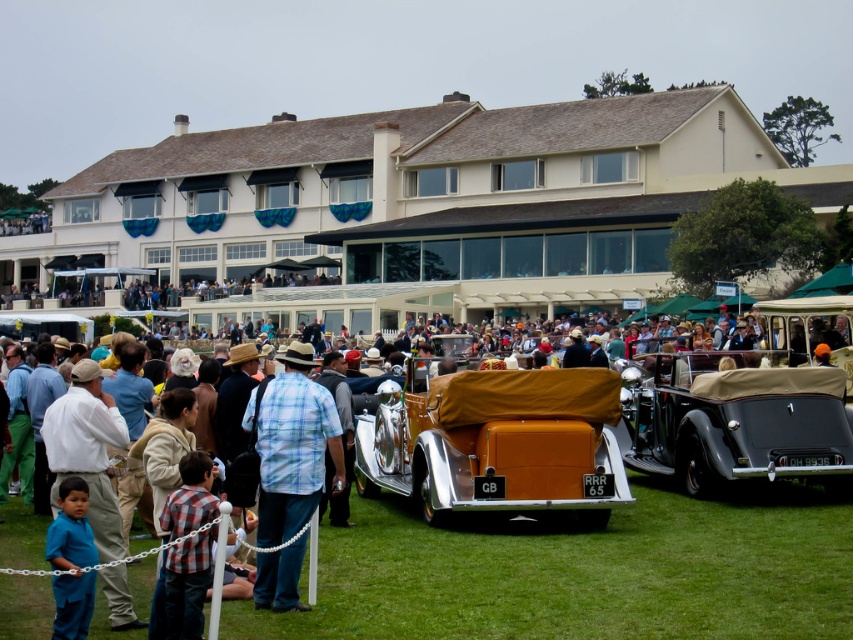
Who is taller, plaid shirt at center or blue cotton shirt at lower left?

With more height is plaid shirt at center.

Between plaid shirt at center and blue cotton shirt at lower left, which one appears on the right side from the viewer's perspective?

Positioned to the right is plaid shirt at center.

Is point (202, 496) positioned in front of point (85, 556)?

That is False.

What are the coordinates of `plaid shirt at center` in the screenshot? It's located at (183, 588).

Does green grass at lower center come behind blue plaid shirt at center?

No, green grass at lower center is in front of blue plaid shirt at center.

Can you confirm if green grass at lower center is taller than blue plaid shirt at center?

In fact, green grass at lower center may be shorter than blue plaid shirt at center.

Which is in front, point (444, 566) or point (277, 433)?

Positioned in front is point (277, 433).

Where is `green grass at lower center`? The height and width of the screenshot is (640, 853). green grass at lower center is located at coordinates (584, 572).

Can you confirm if green grass at lower center is bigger than blue cotton shirt at lower left?

Yes.

Based on the photo, can you confirm if green grass at lower center is thinner than blue cotton shirt at lower left?

In fact, green grass at lower center might be wider than blue cotton shirt at lower left.

Describe the element at coordinates (584, 572) in the screenshot. I see `green grass at lower center` at that location.

Locate an element on the screen. green grass at lower center is located at coordinates (584, 572).